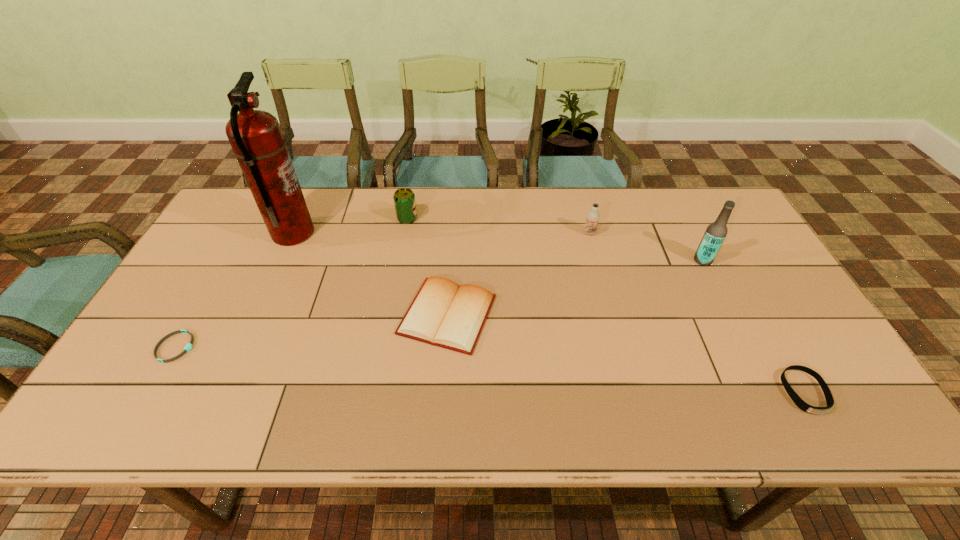
Locate an element on the screen. Image resolution: width=960 pixels, height=540 pixels. chocolate milk that is positioned at the far edge is located at coordinates click(x=593, y=216).

At what (x,y) coordinates should I click in order to perform the action: click on beer can that is at the far edge. Please return your answer as a coordinate pair (x, y). This screenshot has height=540, width=960. Looking at the image, I should click on (404, 199).

Identify the location of object that is at the near edge. (801, 404).

Locate an element on the screen. Image resolution: width=960 pixels, height=540 pixels. object that is at the left edge is located at coordinates (188, 347).

What are the coordinates of `beer bottle that is positioned at the right edge` in the screenshot? It's located at (716, 232).

In order to click on wristband present at the right edge in this screenshot , I will do `click(801, 404)`.

This screenshot has width=960, height=540. In order to click on object present at the near right corner in this screenshot , I will do `click(801, 404)`.

Find the location of `blank area at the far edge`. blank area at the far edge is located at coordinates (471, 205).

Where is `vacant space at the near edge of the desktop`? The height and width of the screenshot is (540, 960). vacant space at the near edge of the desktop is located at coordinates (703, 408).

Identify the location of vacant space at the left edge of the desktop. (229, 255).